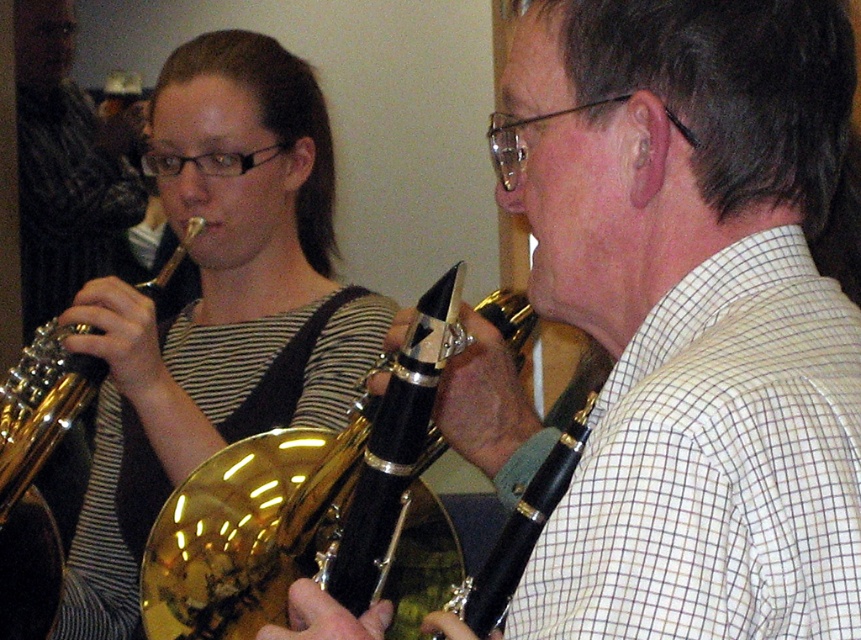
You are a music teacher observing the two students playing their instruments. The matte black clarinet at upper left and the gold shiny trumpet at left are both on the same music stand. Which instrument will require more space on the stand?

The matte black clarinet at upper left is larger in size than the gold shiny trumpet at left, so it will require more space on the stand.

You are a photographer setting up for a music session. You need to place a microphone between the brushed metal saxophone at upper left and the gold shiny trumpet at left. Which side of the saxophone should the microphone be placed to ensure it captures the trumpet better?

The microphone should be placed to the right of the brushed metal saxophone at upper left because the gold shiny trumpet at left is located to its right side.

You are a photographer standing in the room where the musicians are playing. You want to take a closeup photo of the brushed metal saxophone at upper left without moving any objects. Can you step forward to get closer to the saxophone?

The brushed metal saxophone at upper left and viewer are 8.84 feet apart from each other. Since you can move closer, stepping forward would reduce the distance, so yes, you can step forward to get closer to the saxophone.